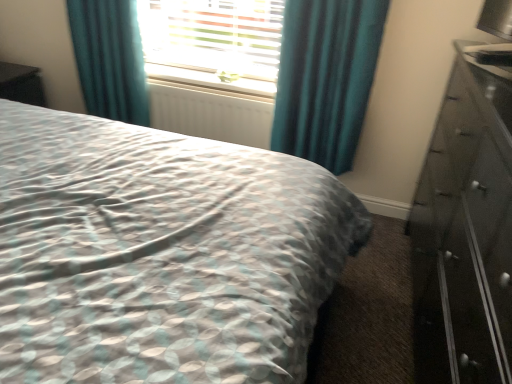
Image resolution: width=512 pixels, height=384 pixels. I want to click on vacant space situated above white plastic window sill at center (from a real-world perspective), so click(204, 79).